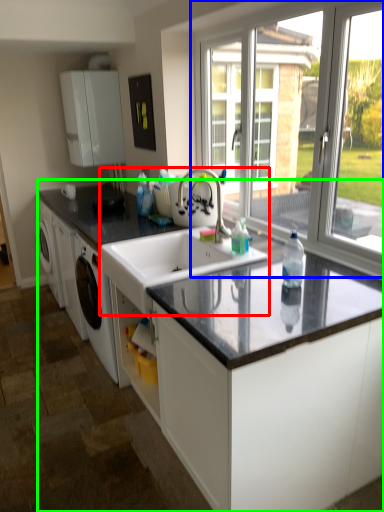
Question: Considering the real-world distances, which object is closest to sink (highlighted by a red box)? window (highlighted by a blue box) or countertop (highlighted by a green box).

Choices:
 (A) window
 (B) countertop

Answer: (B)